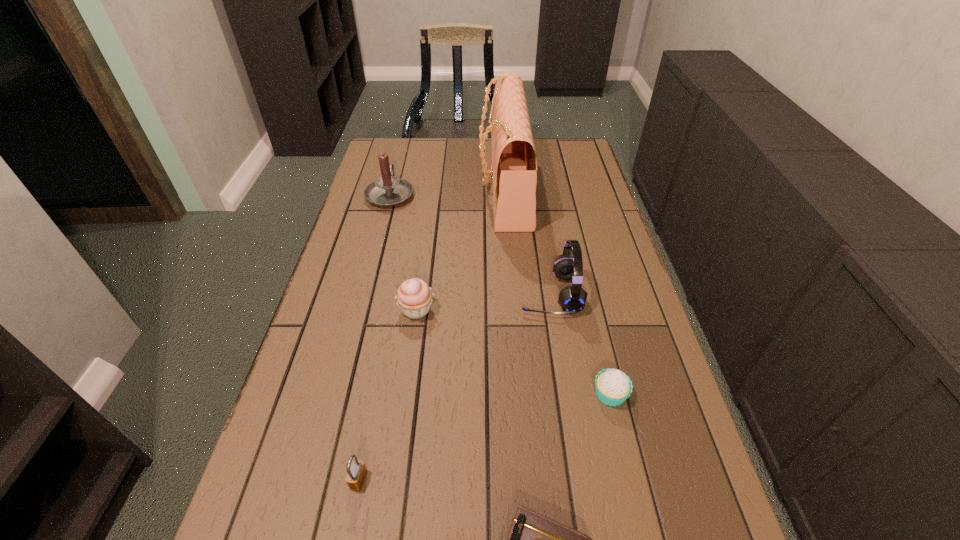
Find the location of a particular element. This screenshot has height=540, width=960. vacant area situated 0.200m on the front-facing side of the handbag is located at coordinates click(x=420, y=188).

Identify the location of vacant space situated 0.130m on the side of the candle with the handle loop. The width and height of the screenshot is (960, 540). (398, 161).

Where is `free space located 0.260m on the side of the candle with the handle loop`? Image resolution: width=960 pixels, height=540 pixels. free space located 0.260m on the side of the candle with the handle loop is located at coordinates (403, 144).

In order to click on free space located 0.090m on the side of the candle with the handle loop in this screenshot , I will do `click(397, 166)`.

Where is `free space located on the ear cushions of the headset`? This screenshot has height=540, width=960. free space located on the ear cushions of the headset is located at coordinates pos(449,294).

Where is `free spot located on the ear cushions of the headset`? The image size is (960, 540). free spot located on the ear cushions of the headset is located at coordinates (410, 294).

In order to click on vacant space situated on the ear cushions of the headset in this screenshot , I will do `click(363, 294)`.

At what (x,y) coordinates should I click in order to perform the action: click on free region located on the left of the taller cupcake. Please return your answer as a coordinate pair (x, y). This screenshot has height=540, width=960. Looking at the image, I should click on pyautogui.click(x=352, y=309).

The width and height of the screenshot is (960, 540). I want to click on vacant space located on the left of the nearer cupcake, so click(458, 394).

You are a GUI agent. You are given a task and a screenshot of the screen. Output one action in this format:
    pyautogui.click(x=<x>, y=<y>)
    Task: Click on the free region located on the right of the padlock
    The width and height of the screenshot is (960, 540).
    Given the screenshot: What is the action you would take?
    pyautogui.click(x=583, y=480)